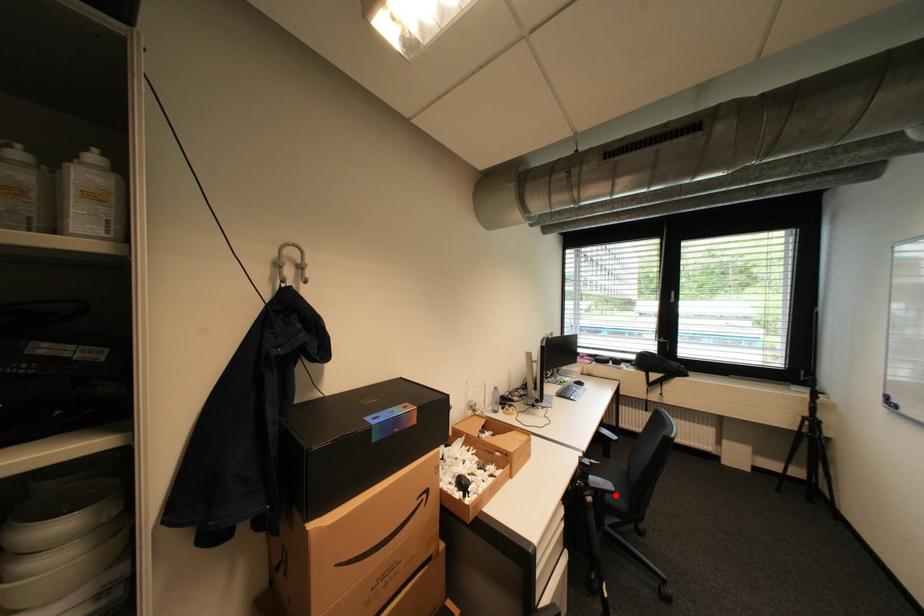
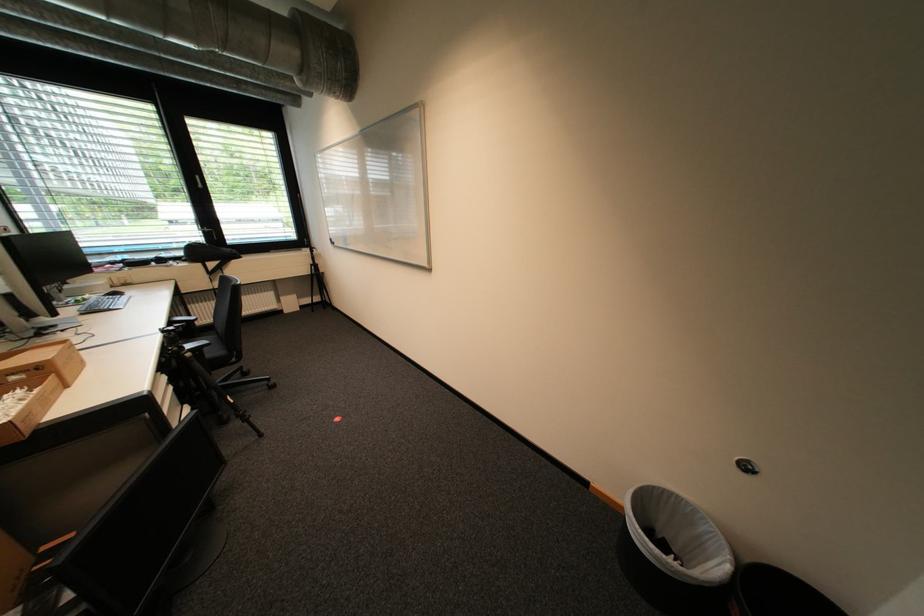
Locate, in the second image, the point that corresponds to the highlighted location in the first image.

(213, 350)